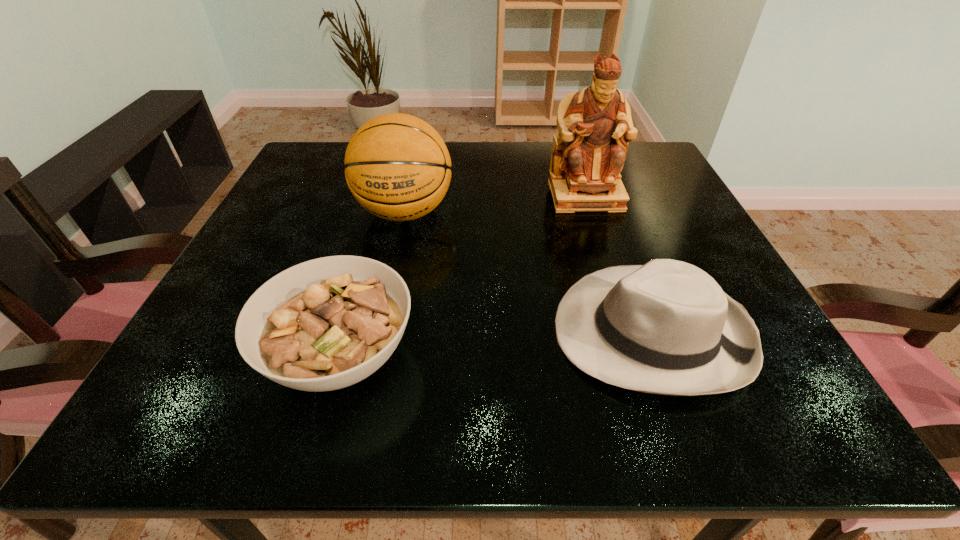
This screenshot has height=540, width=960. I want to click on figurine located in the far edge section of the desktop, so click(595, 125).

Where is `basketball that is at the far edge`? basketball that is at the far edge is located at coordinates pyautogui.click(x=398, y=168).

What are the coordinates of `fedora at the near edge` in the screenshot? It's located at (667, 327).

Find the location of a particular element. stew situated at the near edge is located at coordinates (325, 324).

Locate an element on the screen. The height and width of the screenshot is (540, 960). object present at the left edge is located at coordinates (325, 324).

Locate an element on the screen. figurine that is at the right edge is located at coordinates (595, 125).

Where is `fedora that is at the right edge`? fedora that is at the right edge is located at coordinates (667, 327).

Identify the location of object situated at the near left corner. [x=325, y=324].

I want to click on object positioned at the far right corner, so click(x=595, y=125).

Where is `object that is at the near right corner`? Image resolution: width=960 pixels, height=540 pixels. object that is at the near right corner is located at coordinates (667, 327).